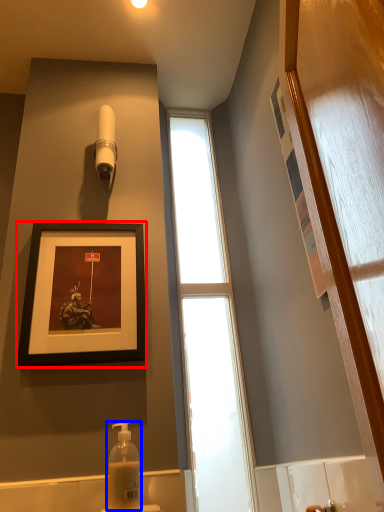
Question: Which object appears farthest to the camera in this image, picture frame (highlighted by a red box) or soap dispenser (highlighted by a blue box)?

Choices:
 (A) picture frame
 (B) soap dispenser

Answer: (A)